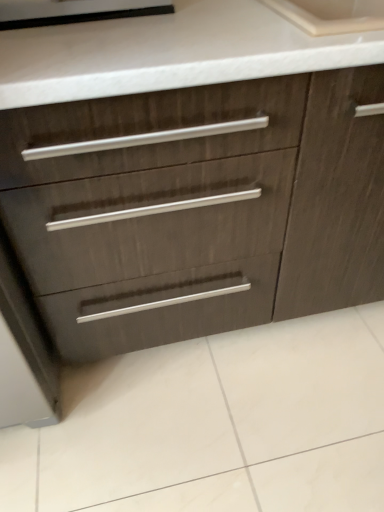
In order to click on free location in front of black rubber seal at upper left in this screenshot , I will do `click(94, 46)`.